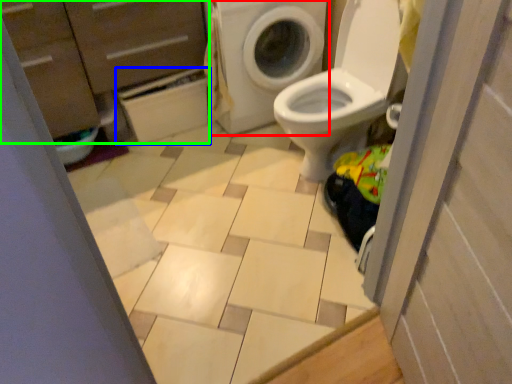
Question: Estimate the real-world distances between objects in this image. Which object is closer to washing machine (highlighted by a red box), cabinetry (highlighted by a blue box) or dresser (highlighted by a green box)?

Choices:
 (A) cabinetry
 (B) dresser

Answer: (A)